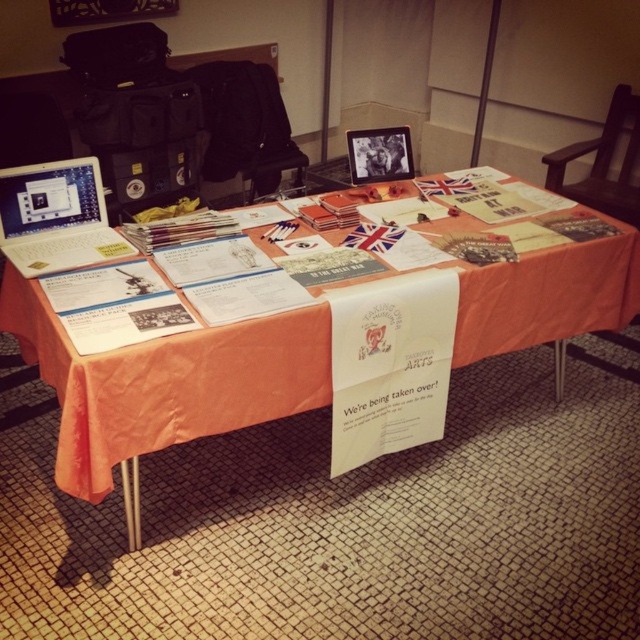
Does orange fabric tablecloth at center come in front of silver metallic laptop at left?

Yes.

Does orange fabric tablecloth at center have a greater width compared to silver metallic laptop at left?

Indeed, orange fabric tablecloth at center has a greater width compared to silver metallic laptop at left.

The width and height of the screenshot is (640, 640). What do you see at coordinates (164, 385) in the screenshot? I see `orange fabric tablecloth at center` at bounding box center [164, 385].

This screenshot has width=640, height=640. I want to click on orange fabric tablecloth at center, so click(164, 385).

Which is more to the left, silver metallic laptop at left or matte black tablet at upper center?

silver metallic laptop at left is more to the left.

How distant is silver metallic laptop at left from matte black tablet at upper center?

8.62 feet

Is point (54, 225) more distant than point (353, 176)?

No, (54, 225) is in front of (353, 176).

Locate an element on the screen. silver metallic laptop at left is located at coordinates (56, 218).

Is orange fabric tablecloth at center bigger than matte black tablet at upper center?

Yes.

Which is above, orange fabric tablecloth at center or matte black tablet at upper center?

matte black tablet at upper center is above.

Who is more distant from viewer, (54, 337) or (408, 129)?

Point (408, 129)

Locate an element on the screen. orange fabric tablecloth at center is located at coordinates (164, 385).